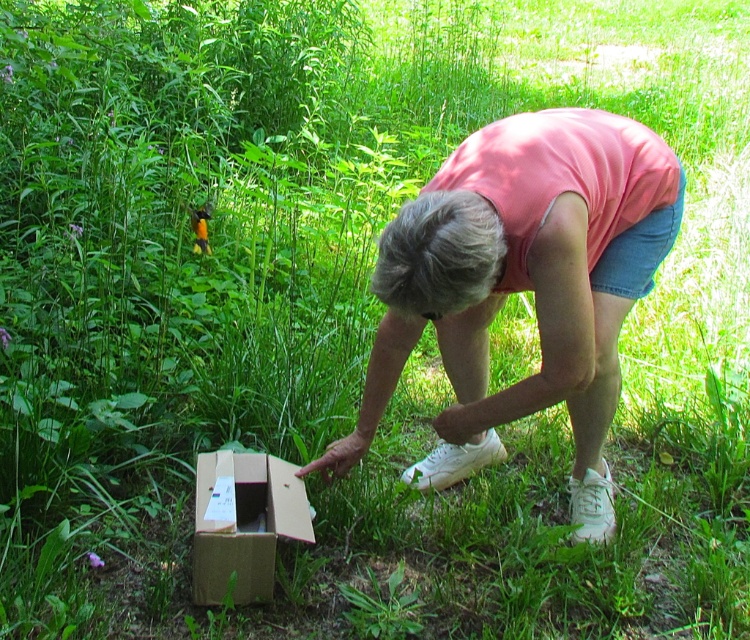
You are a photographer trying to capture the scene with a wide angle lens. You want to ensure both the pink fabric squat at center and the cardboard box at lower left are clearly visible in the frame. Given their sizes, which object might require you to adjust your camera angle to avoid cropping?

The pink fabric squat at center is larger in size than the cardboard box at lower left, so it might require adjusting the camera angle more to ensure it fits within the frame without cropping.